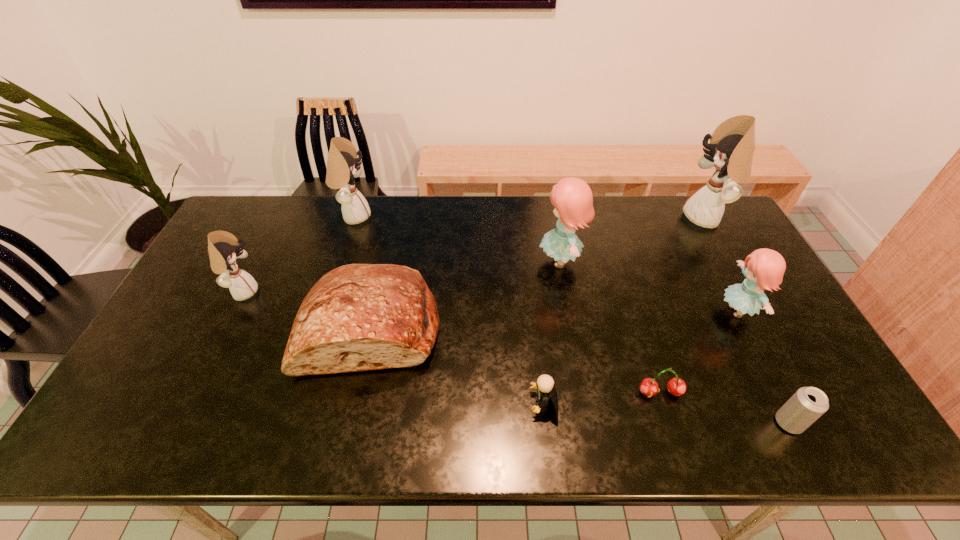
At what (x,y) coordinates should I click in order to perform the action: click on vacant space located 0.060m on the front-facing side of the bigger blue doll. Please return your answer as a coordinate pair (x, y). Looking at the image, I should click on (518, 261).

The height and width of the screenshot is (540, 960). What are the coordinates of `free region located at the front face of the leftmost doll` in the screenshot? It's located at (332, 292).

The height and width of the screenshot is (540, 960). In order to click on free spot located on the front-facing side of the right blue doll in this screenshot , I will do `click(655, 311)`.

Locate an element on the screen. This screenshot has height=540, width=960. vacant area located 0.100m on the front-facing side of the right blue doll is located at coordinates (683, 311).

Where is `vacant area located 0.350m on the front-facing side of the right blue doll`? The image size is (960, 540). vacant area located 0.350m on the front-facing side of the right blue doll is located at coordinates (595, 311).

Locate an element on the screen. This screenshot has width=960, height=540. vacant space located 0.160m at the sliced front of the fourth shortest object is located at coordinates (346, 446).

I want to click on vacant space located on the left of the white beer can, so click(703, 423).

At what (x,y) coordinates should I click in order to perform the action: click on free space located on the front-facing side of the Lego. Please return your answer as a coordinate pair (x, y). Looking at the image, I should click on (369, 403).

Find the location of `free space located 0.170m on the front-facing side of the Lego`. free space located 0.170m on the front-facing side of the Lego is located at coordinates (460, 403).

Where is `vacant space situated on the front-facing side of the Lego`? vacant space situated on the front-facing side of the Lego is located at coordinates (401, 403).